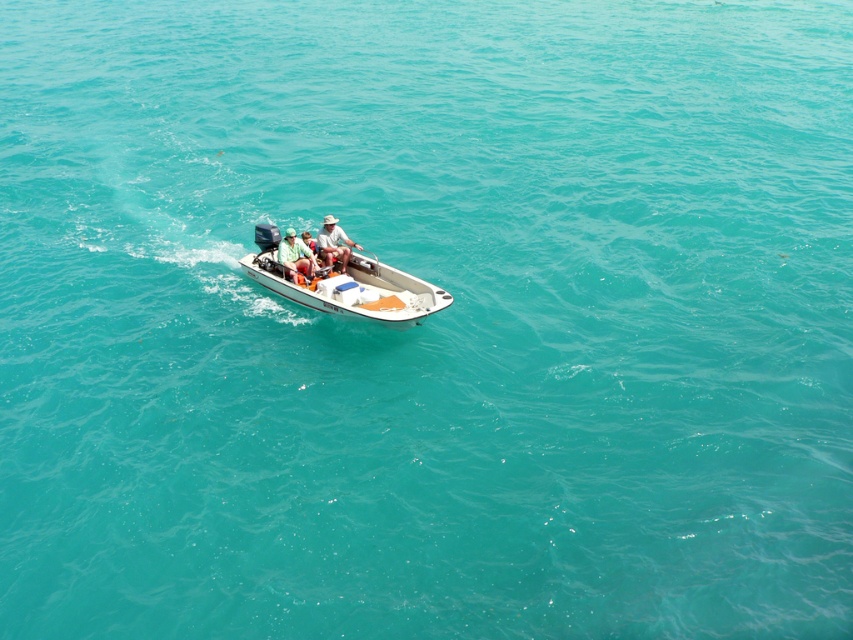
You are a photographer trying to capture the white matte boat at center and the green fabric shirt at center in the same frame. Based on their sizes, which object would appear larger in the photo?

The white matte boat at center would appear larger in the photo since its width is larger than the green fabric shirt at center.

You are a photographer trying to capture a clear photo of the white matte boat at center and the green fabric shirt at center. Since you want to focus on the boat, which object should you zoom in on more and why?

You should zoom in more on the white matte boat at center because it is larger in size than the green fabric shirt at center, making it easier to focus on while capturing the photo.

You are a passenger on the white matte boat at center and want to place your tan woven hat at center somewhere on the boat. Based on the boat layout, where should you place your hat so it won

The white matte boat at center is in front of the tan woven hat at center, so you should place the tan woven hat at center behind the white matte boat at center to ensure it stays in place.